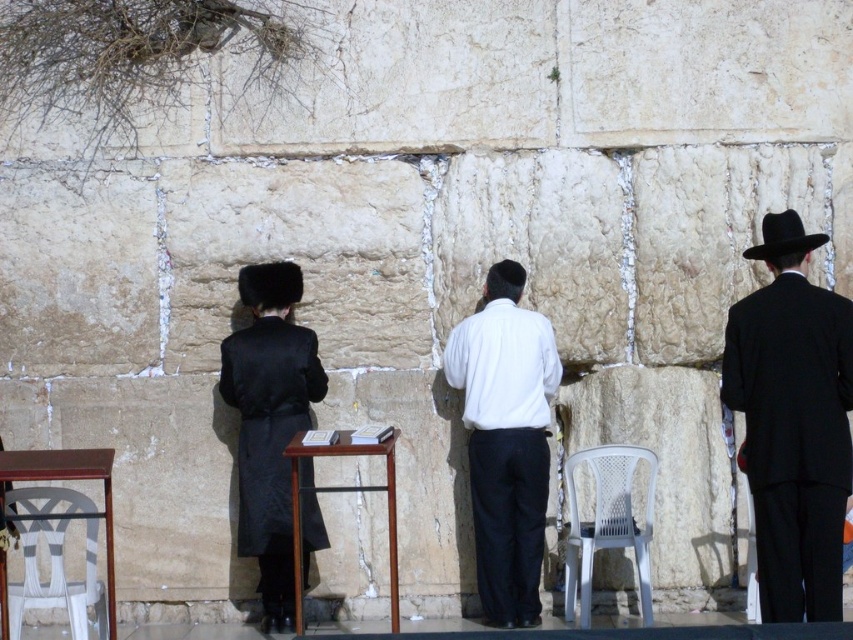
You are a photographer trying to capture a clear shot of the white matte shirt at center and the white plastic chair at lower left. Since both are white, you need to adjust your camera settings to distinguish them. Which object should you focus on first to ensure proper exposure, considering their positions?

The white matte shirt at center should be focused on first because it is above the white plastic chair at lower left, making it closer to the camera and thus requiring proper exposure before adjusting for the chair below.

You are standing in front of a historical stone wall and see a white plastic chair at center and a wooden table at center. Which object is positioned higher relative to the other?

The white plastic chair at center is located above the wooden table at center, so it is positioned higher.

What is the color of the clothing item located at the coordinates point (506, 440)?

The clothing item at point (506, 440) is a white matte shirt at center.